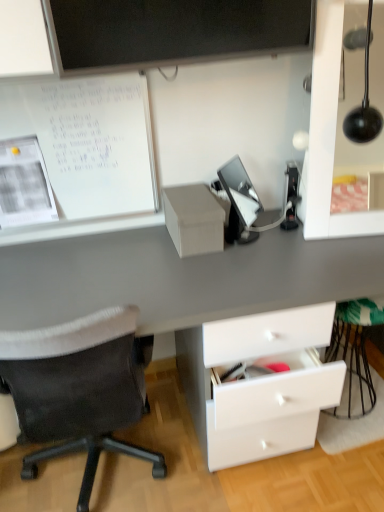
Find the location of a particular element. The image size is (384, 512). vacant space to the left of matte black lamp at upper right is located at coordinates (280, 236).